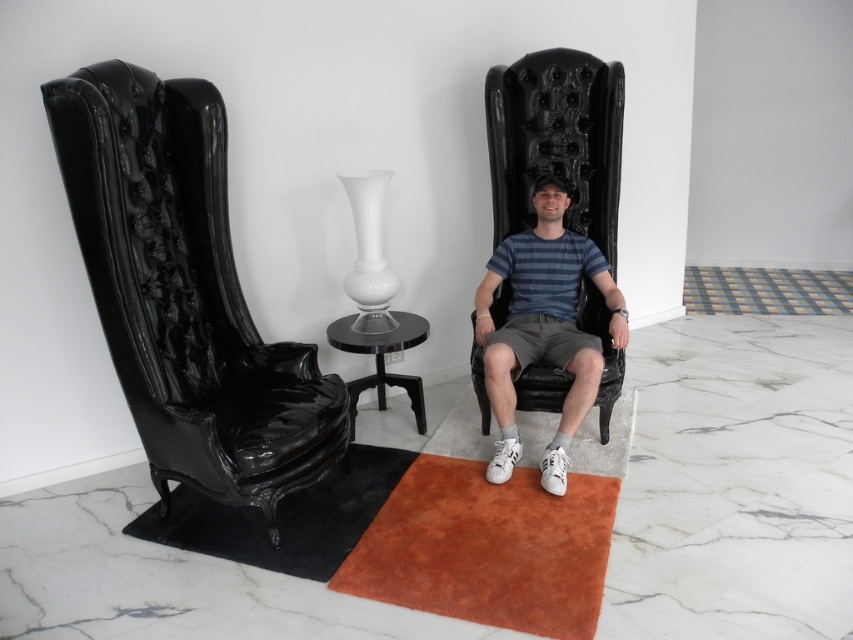
Question: Is glossy black armchair at left to the right of black rubber mat at lower left from the viewer's perspective?

Choices:
 (A) no
 (B) yes

Answer: (A)

Question: From the image, what is the correct spatial relationship of glossy black armchair at left in relation to suede-like orange mat at lower center?

Choices:
 (A) above
 (B) below

Answer: (A)

Question: Can you confirm if glossy black armchair at left is positioned above suede-like orange mat at lower center?

Choices:
 (A) no
 (B) yes

Answer: (B)

Question: Which point is farther from the camera taking this photo?

Choices:
 (A) (370, 477)
 (B) (546, 534)
 (C) (102, 209)
 (D) (558, 308)

Answer: (D)

Question: Which of the following is the closest to the observer?

Choices:
 (A) (288, 506)
 (B) (514, 397)
 (C) (538, 531)

Answer: (C)

Question: Which object appears farthest from the camera in this image?

Choices:
 (A) suede-like orange mat at lower center
 (B) glossy black armchair at left
 (C) matte black chair at center

Answer: (C)